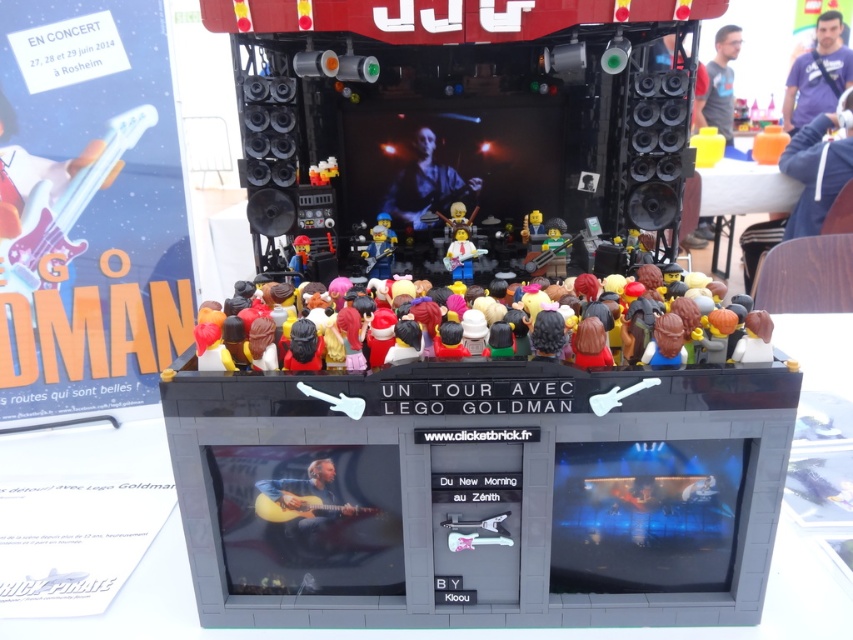
Does point (314, 516) come behind point (846, 147)?

No, (314, 516) is closer to viewer.

Between point (281, 480) and point (813, 212), which one is positioned behind?

Point (813, 212)

Find the location of a particular element. wooden acoustic guitar at center is located at coordinates (309, 506).

Can you confirm if purple shirt at upper right is positioned to the left of white plastic guitar at center?

No, purple shirt at upper right is not to the left of white plastic guitar at center.

Is purple shirt at upper right below white plastic guitar at center?

No, purple shirt at upper right is not below white plastic guitar at center.

Between point (811, 56) and point (456, 250), which one is positioned in front?

Positioned in front is point (456, 250).

The height and width of the screenshot is (640, 853). In order to click on purple shirt at upper right in this screenshot , I will do `click(817, 74)`.

Is purple shirt at upper right thinner than gray fabric shirt at upper right?

No.

Which of these two, purple shirt at upper right or gray fabric shirt at upper right, stands taller?

purple shirt at upper right is taller.

Consider the image. Who is more forward, [810,90] or [699,120]?

Point [699,120]

Where is `purple shirt at upper right`? The height and width of the screenshot is (640, 853). purple shirt at upper right is located at coordinates (817, 74).